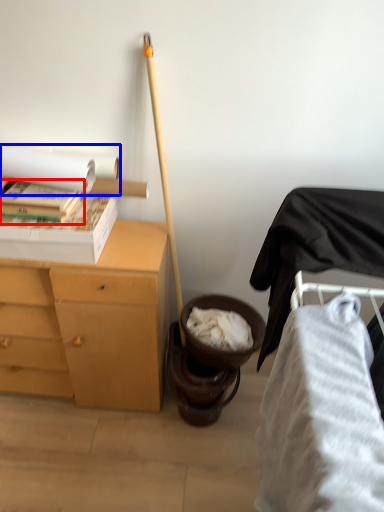
Question: Which object appears farthest to the camera in this image, book (highlighted by a red box) or toilet paper (highlighted by a blue box)?

Choices:
 (A) book
 (B) toilet paper

Answer: (A)